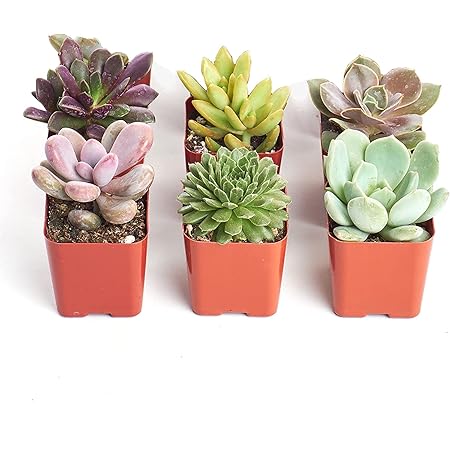
Where is `flower container`? flower container is located at coordinates (241, 278).